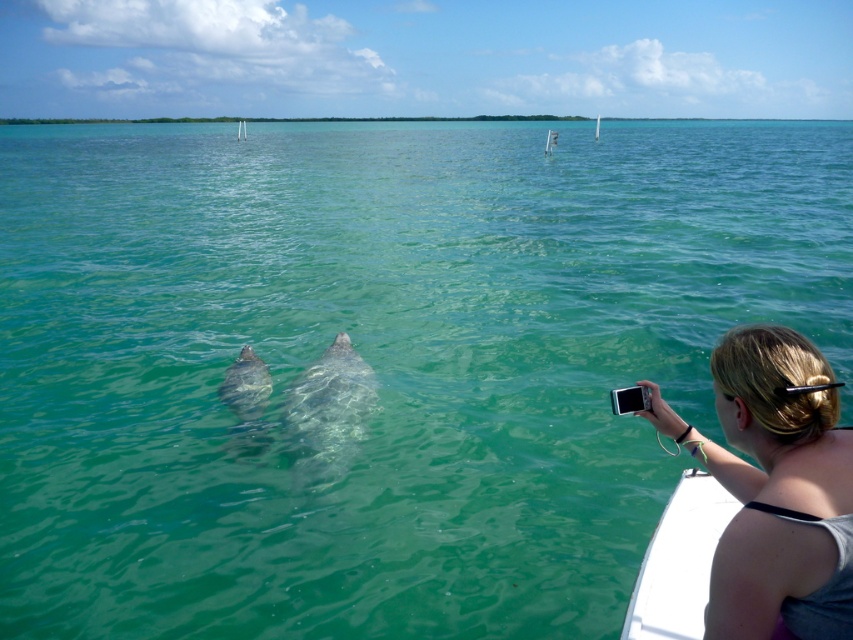
Question: Is blonde hair at upper right to the right of gray matte whale at center from the viewer's perspective?

Choices:
 (A) yes
 (B) no

Answer: (A)

Question: Which point appears closest to the camera in this image?

Choices:
 (A) (292, 417)
 (B) (242, 129)

Answer: (A)

Question: Which point is farther to the camera?

Choices:
 (A) (721, 580)
 (B) (245, 124)
 (C) (241, 413)

Answer: (B)

Question: Is blonde hair at upper right above white plastic pole at upper center?

Choices:
 (A) no
 (B) yes

Answer: (A)

Question: Which of the following is the farthest from the observer?

Choices:
 (A) (235, 371)
 (B) (242, 134)
 (C) (779, 598)
 (D) (332, 358)

Answer: (B)

Question: Is gray matte whale at center smaller than white plastic pole at upper center?

Choices:
 (A) no
 (B) yes

Answer: (B)